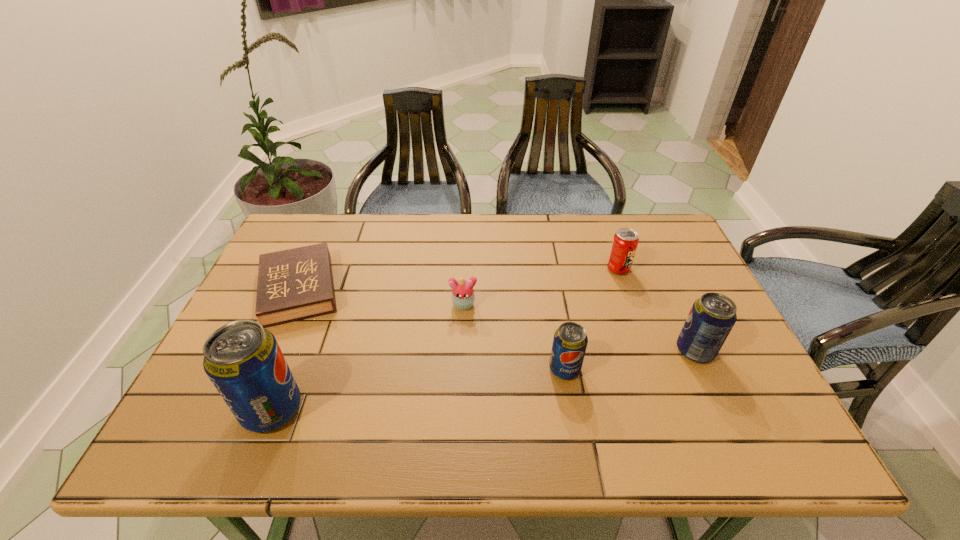
In order to click on the nearest object in this screenshot , I will do `click(243, 360)`.

The height and width of the screenshot is (540, 960). What are the coordinates of `the nearest soda can` in the screenshot? It's located at (243, 360).

Locate an element on the screen. the third object from right to left is located at coordinates (570, 341).

Identify the location of the rightmost soda can. The width and height of the screenshot is (960, 540). (712, 317).

Where is `the third shortest soda can`? The width and height of the screenshot is (960, 540). the third shortest soda can is located at coordinates (712, 317).

This screenshot has height=540, width=960. Identify the location of the shortest object. (297, 283).

Find the location of `the farthest soda can`. the farthest soda can is located at coordinates (625, 241).

Where is `the third soda can from left to right`? the third soda can from left to right is located at coordinates (625, 241).

Where is `cupcake`? cupcake is located at coordinates (463, 296).

What are the coordinates of `the fourth object from right to left` in the screenshot? It's located at (463, 296).